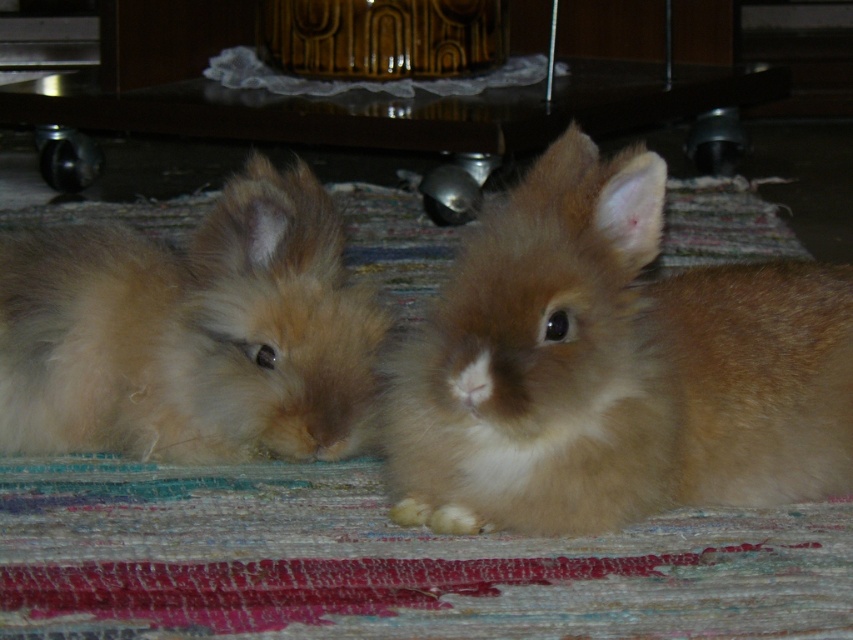
You are a pet sitter and need to separate the two rabbits. You have a divider that can only fit between them if there is space. Based on the image, can you place the divider between the fuzzy brown rabbit at center and the fuzzy brown rabbit at left?

The fuzzy brown rabbit at center is positioned on the right side of the fuzzy brown rabbit at left, so there is space between them to place the divider.

You are a photographer trying to capture the rabbits on the patterned rug. You notice a specific point marked at coordinates (613, 368). What object is located at this point?

The fuzzy brown rabbit at center is located at point (613, 368).

You are a small toy mouse that is 3 inches long. You want to move from the fuzzy brown rabbit at left to the fuzzy brown rabbit at center. Is there enough space for you to move between them?

The distance between the fuzzy brown rabbit at left and the fuzzy brown rabbit at center is 9.52 inches. Since the toy mouse is only 3 inches long, there is ample space for it to move between them.